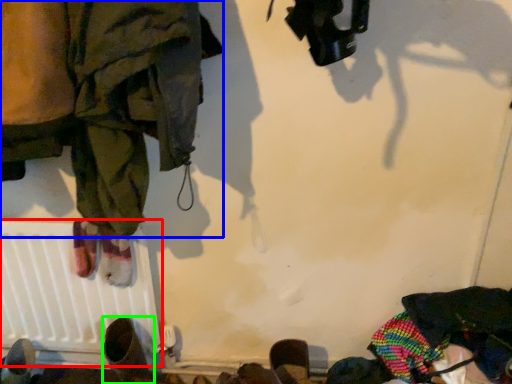
Question: Based on their relative distances, which object is farther from radiator (highlighted by a red box)? Choose from clothing (highlighted by a blue box) and footwear (highlighted by a green box).

Choices:
 (A) clothing
 (B) footwear

Answer: (A)